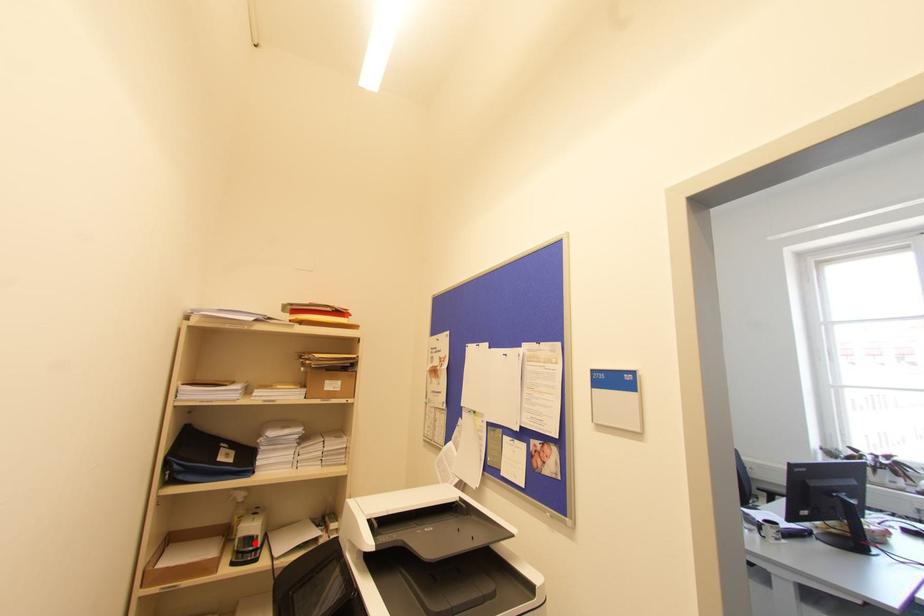
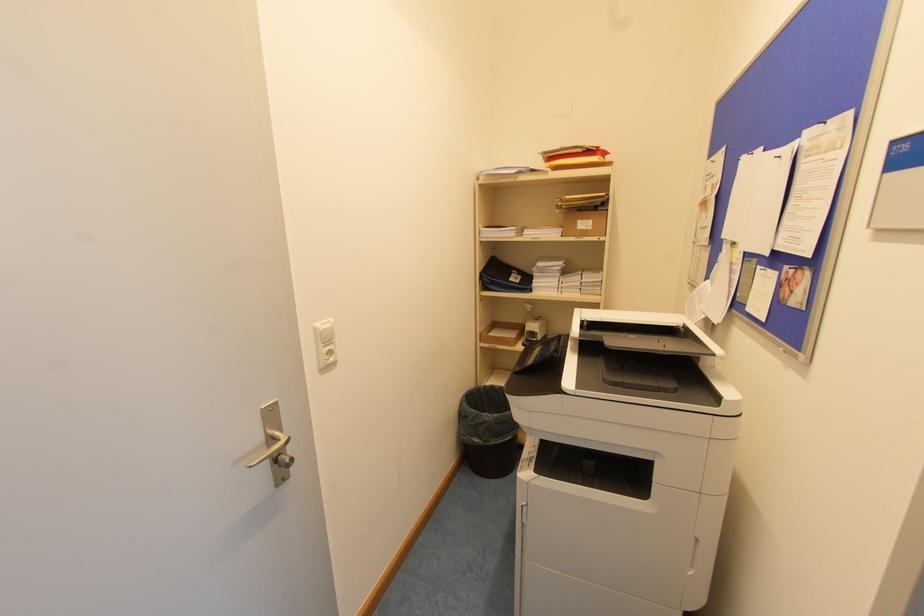
Find the pixel in the second image that matches the highlighted location in the first image.

(536, 337)